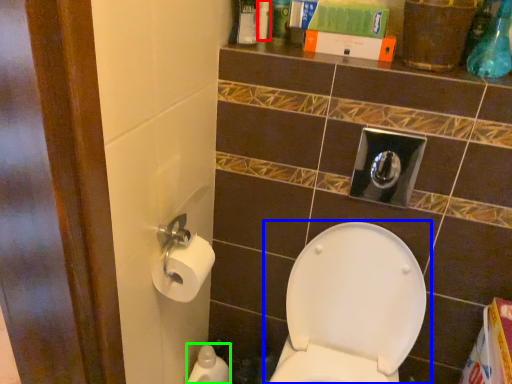
Question: Which is farther away from toiletry (highlighted by a red box)? toilet (highlighted by a blue box) or cleaning product (highlighted by a green box)?

Choices:
 (A) toilet
 (B) cleaning product

Answer: (B)